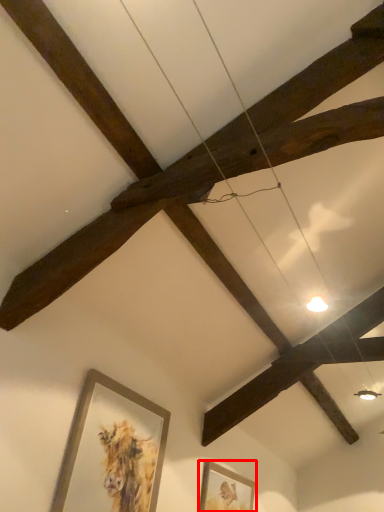
Question: From the image's perspective, what is the correct spatial positioning of picture frame (annotated by the red box) in reference to picture frame?

Choices:
 (A) below
 (B) above

Answer: (A)